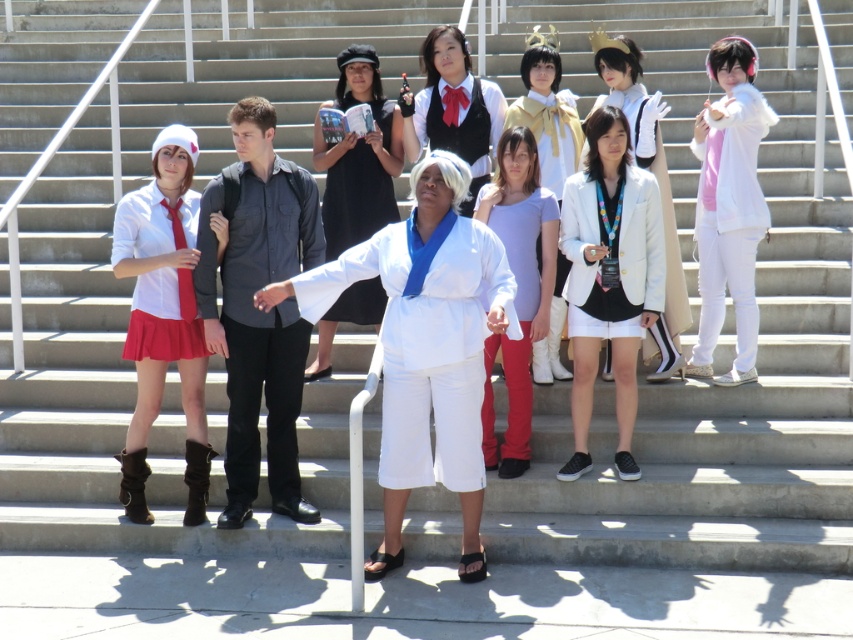
Is matte black shirt at center thinner than white matte hoodie at right?

In fact, matte black shirt at center might be wider than white matte hoodie at right.

Is point (288, 483) positioned before point (752, 218)?

Yes, it is in front of point (752, 218).

The width and height of the screenshot is (853, 640). What do you see at coordinates (260, 316) in the screenshot?
I see `matte black shirt at center` at bounding box center [260, 316].

The image size is (853, 640). I want to click on matte black shirt at center, so click(260, 316).

The width and height of the screenshot is (853, 640). Describe the element at coordinates (426, 342) in the screenshot. I see `white cotton karate uniform at center` at that location.

How much distance is there between white cotton karate uniform at center and matte black shirt at center?

36.59 inches

The width and height of the screenshot is (853, 640). Find the location of `white cotton karate uniform at center`. white cotton karate uniform at center is located at coordinates (x=426, y=342).

Which is more to the left, matte black shirt at center or white matte jacket at center?

Positioned to the left is matte black shirt at center.

Between point (306, 349) and point (672, 305), which one is positioned in front?

Positioned in front is point (306, 349).

Where is `matte black shirt at center`? This screenshot has width=853, height=640. matte black shirt at center is located at coordinates (260, 316).

This screenshot has width=853, height=640. I want to click on matte black shirt at center, so click(260, 316).